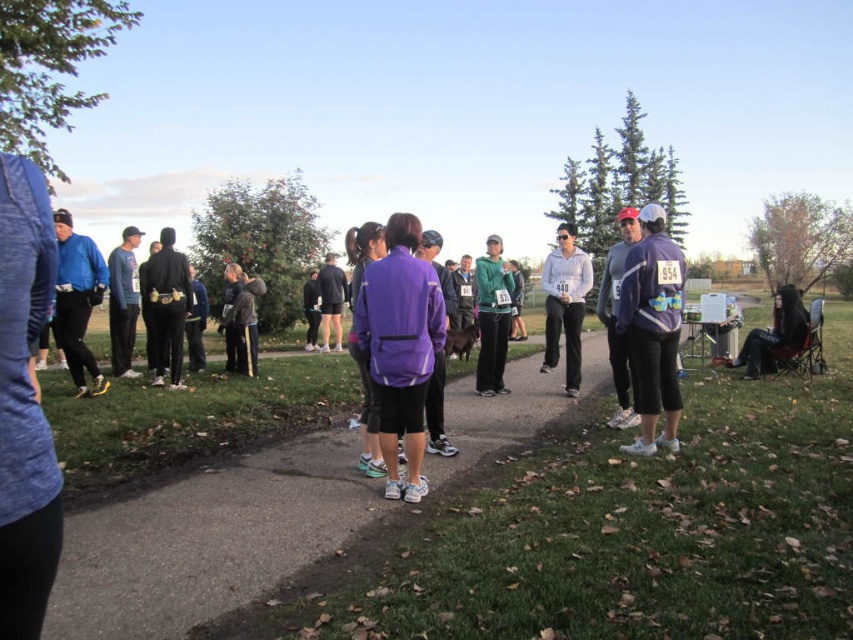
What do you see at coordinates (77, 300) in the screenshot? I see `matte blue jacket at left` at bounding box center [77, 300].

Between point (56, 314) and point (132, 307), which one is positioned in front?

Point (56, 314)

Does point (86, 358) come behind point (122, 328)?

That is False.

Locate an element on the screen. matte blue jacket at left is located at coordinates (77, 300).

Which of these two, matte black jacket at lower right or black fabric shorts at center, stands taller?

black fabric shorts at center

Can you confirm if matte black jacket at lower right is positioned to the right of black fabric shorts at center?

Correct, you'll find matte black jacket at lower right to the right of black fabric shorts at center.

Where is `matte black jacket at lower right`? The width and height of the screenshot is (853, 640). matte black jacket at lower right is located at coordinates (775, 336).

Does matte blue jacket at left have a greater width compared to dark brown leather jacket at center?

Correct, the width of matte blue jacket at left exceeds that of dark brown leather jacket at center.

Can you confirm if matte blue jacket at left is taller than dark brown leather jacket at center?

Yes.

Which is behind, point (74, 348) or point (252, 362)?

Point (252, 362)

Find the location of `matte blue jacket at left`. matte blue jacket at left is located at coordinates (77, 300).